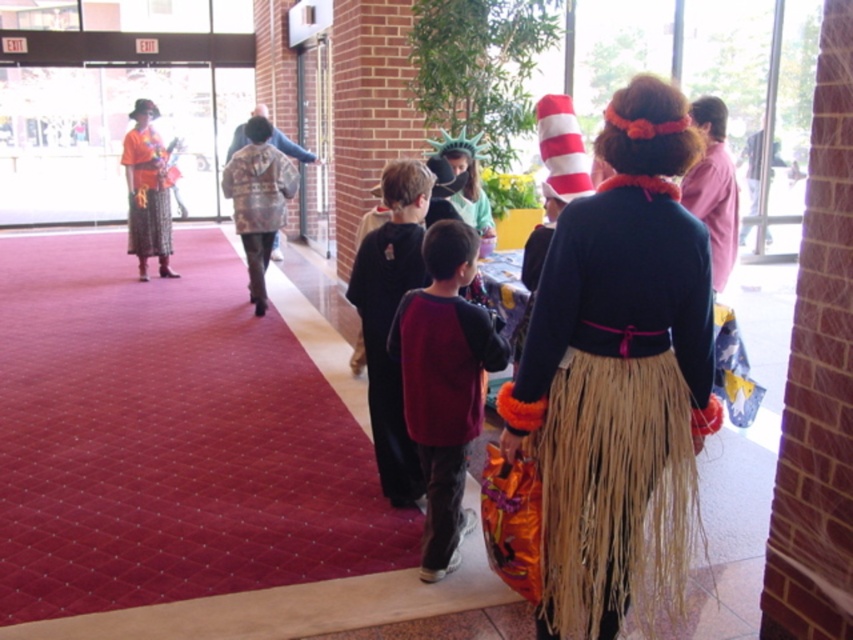
Question: Does maroon fleece sweater at center have a lesser width compared to orange printed fabric skirt at left?

Choices:
 (A) no
 (B) yes

Answer: (B)

Question: Is velvet maroon vest at center bigger than orange printed fabric skirt at left?

Choices:
 (A) yes
 (B) no

Answer: (B)

Question: Which point is closer to the camera?

Choices:
 (A) velvet maroon vest at center
 (B) natural straw skirt at center
 (C) pink fabric shirt at upper right

Answer: (B)

Question: Among these objects, which one is farthest from the camera?

Choices:
 (A) natural straw skirt at center
 (B) orange printed fabric skirt at left
 (C) patterned fabric cape at center
 (D) pink fabric shirt at upper right

Answer: (B)

Question: Based on their relative distances, which object is farther from the orange printed fabric skirt at left?

Choices:
 (A) velvet maroon vest at center
 (B) pink fabric shirt at upper right
 (C) patterned fabric cape at center

Answer: (B)

Question: Does maroon fleece sweater at center appear on the right side of velvet maroon vest at center?

Choices:
 (A) no
 (B) yes

Answer: (B)